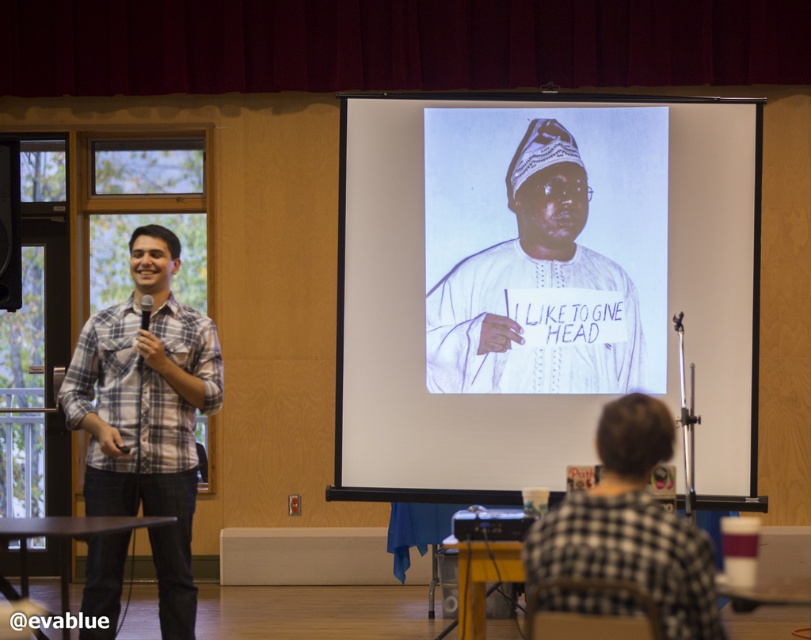
Question: Can you confirm if plaid shirt at left is positioned below black plastic projector at lower center?

Choices:
 (A) no
 (B) yes

Answer: (A)

Question: Which of these objects is positioned farthest from the white matte clothing at center?

Choices:
 (A) white paper at center
 (B) black plastic projector at lower center

Answer: (B)

Question: Which point is farther to the camera?

Choices:
 (A) plaid shirt at left
 (B) white paper at center
 (C) black checkered shirt at lower right

Answer: (B)

Question: Is plaid shirt at left to the right of white matte clothing at center from the viewer's perspective?

Choices:
 (A) no
 (B) yes

Answer: (A)

Question: From the image, what is the correct spatial relationship of white matte clothing at center in relation to matte plaid shirt at left?

Choices:
 (A) below
 (B) above

Answer: (A)

Question: Which object is closer to the camera taking this photo?

Choices:
 (A) black plastic projector at lower center
 (B) black checkered shirt at lower right
 (C) white matte clothing at center

Answer: (B)